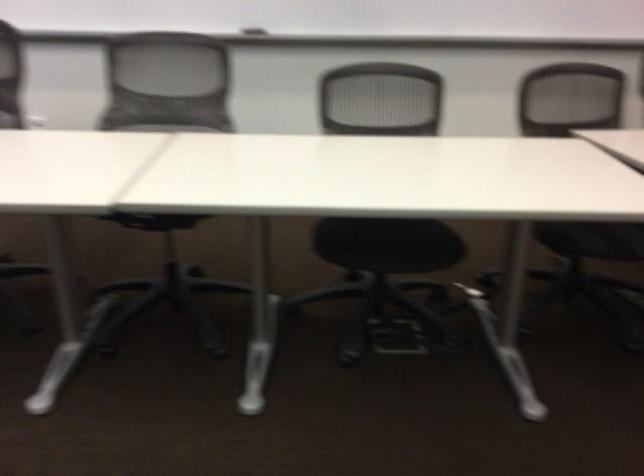
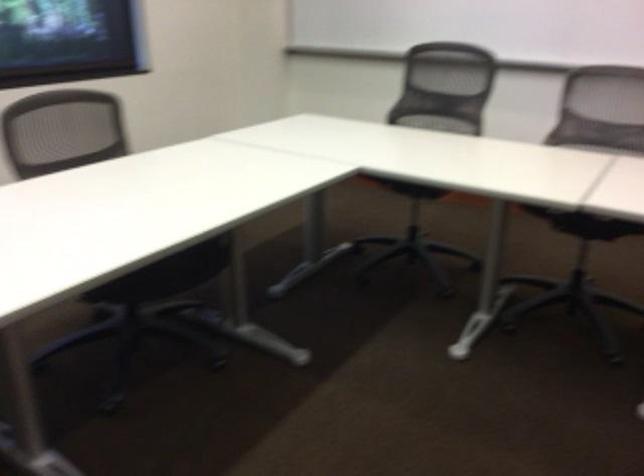
The point at (153, 219) is marked in the first image. Where is the corresponding point in the second image?

(585, 223)